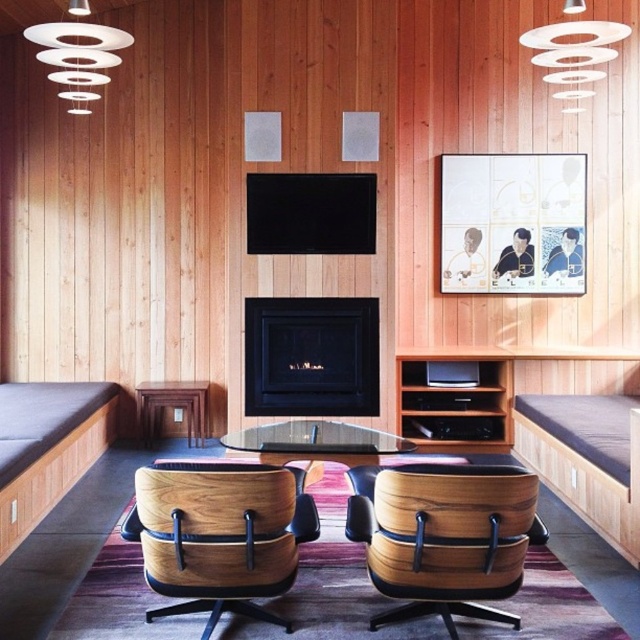
Question: Which point is farther from the camera taking this photo?

Choices:
 (A) (365, 364)
 (B) (227, 531)
 (C) (422, 388)

Answer: (C)

Question: Which point is closer to the camera?

Choices:
 (A) wooden table at center
 (B) light brown wood swivel chair at center
 (C) wooden cushioned bench at right
 (D) brown wood entertainment center at center

Answer: (B)

Question: Does wooden/daybed at center come in front of wooden swivel chair at center?

Choices:
 (A) yes
 (B) no

Answer: (B)

Question: Is dark brown leather couch at lower left further to the viewer compared to transparent glass table at center?

Choices:
 (A) yes
 (B) no

Answer: (B)

Question: Among these objects, which one is farthest from the camera?

Choices:
 (A) dark brown leather couch at lower left
 (B) wooden swivel chair at center
 (C) brown wood entertainment center at center
 (D) black matte fireplace at center

Answer: (C)

Question: Can you confirm if wooden/daybed at center is bigger than wooden swivel chair at center?

Choices:
 (A) no
 (B) yes

Answer: (B)